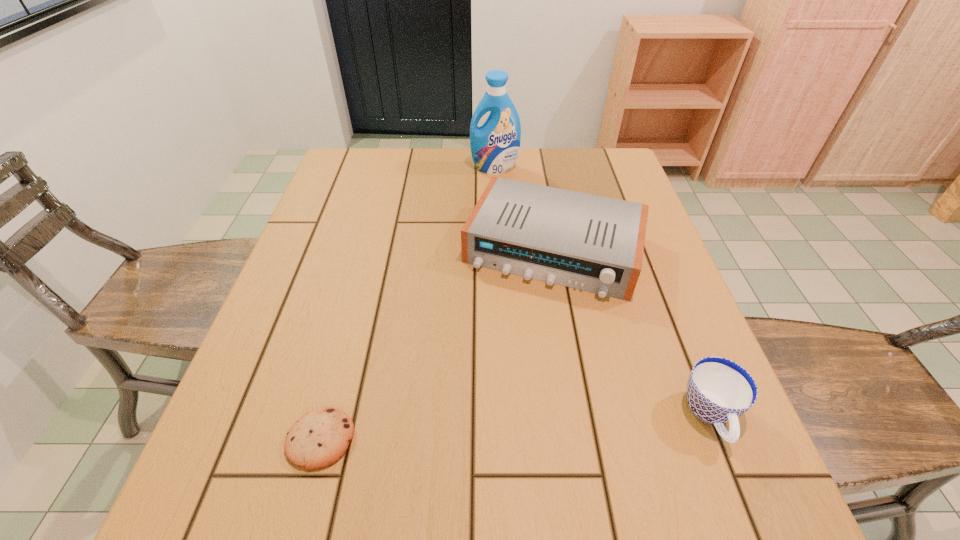
Identify the location of the shortest object. (317, 440).

The height and width of the screenshot is (540, 960). Identify the location of cookie. (317, 440).

Where is `the third tallest object`? This screenshot has height=540, width=960. the third tallest object is located at coordinates (719, 390).

Where is `the tallest object`? This screenshot has width=960, height=540. the tallest object is located at coordinates (495, 145).

In order to click on the farthest object in this screenshot , I will do `click(495, 145)`.

In order to click on the third shortest object in this screenshot , I will do `click(592, 243)`.

What are the coordinates of `the second farthest object` in the screenshot? It's located at [592, 243].

Locate an element on the screen. This screenshot has width=960, height=540. vacant space located 0.070m on the right of the shortest object is located at coordinates (396, 439).

Image resolution: width=960 pixels, height=540 pixels. Find the location of `free spot located 0.270m on the front-facing side of the farthest object`. free spot located 0.270m on the front-facing side of the farthest object is located at coordinates coord(496,231).

Image resolution: width=960 pixels, height=540 pixels. What are the coordinates of `free point located on the front-facing side of the farthest object` in the screenshot? It's located at (496, 226).